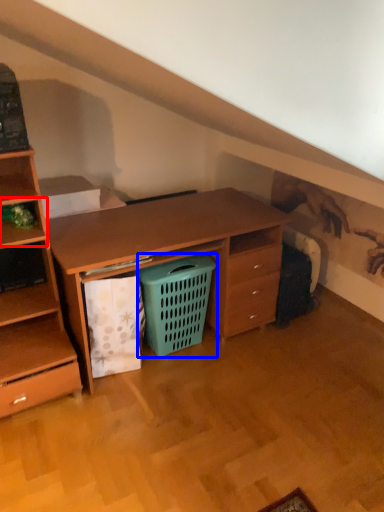
Question: Which object is closer to the camera taking this photo, shelf (highlighted by a red box) or shopping basket (highlighted by a blue box)?

Choices:
 (A) shelf
 (B) shopping basket

Answer: (A)